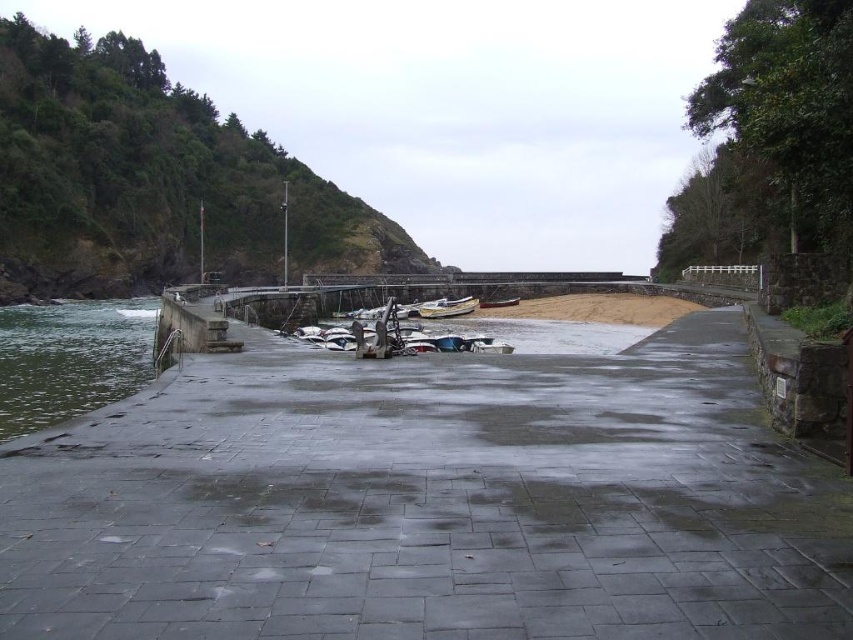
Which is in front, point (158, 595) or point (76, 394)?

Point (158, 595) is in front.

You are a GUI agent. You are given a task and a screenshot of the screen. Output one action in this format:
    pyautogui.click(x=<x>, y=<y>)
    Task: Click on the smooth concrete dock at center
    The height and width of the screenshot is (640, 853).
    Given the screenshot: What is the action you would take?
    pyautogui.click(x=430, y=500)

Which is behind, point (693, 401) or point (74, 307)?

The point (74, 307) is behind.

Where is `smooth concrete dock at center`? The image size is (853, 640). smooth concrete dock at center is located at coordinates (430, 500).

Between point (16, 368) and point (456, 300), which one is positioned behind?

Positioned behind is point (456, 300).

Is point (50, 420) behind point (450, 301)?

That is False.

Which is in front, point (136, 317) or point (451, 304)?

Point (451, 304) is in front.

At what (x,y) coordinates should I click in order to perform the action: click on green smooth water at lower left. Please return your answer as a coordinate pair (x, y). Looking at the image, I should click on point(70,358).

Consider the image. Between smooth concrete dock at center and wooden boat at center, which one appears on the left side from the viewer's perspective?

From the viewer's perspective, smooth concrete dock at center appears more on the left side.

Is point (436, 403) less distant than point (489, 301)?

Yes.

Find the location of a particular element. smooth concrete dock at center is located at coordinates (430, 500).